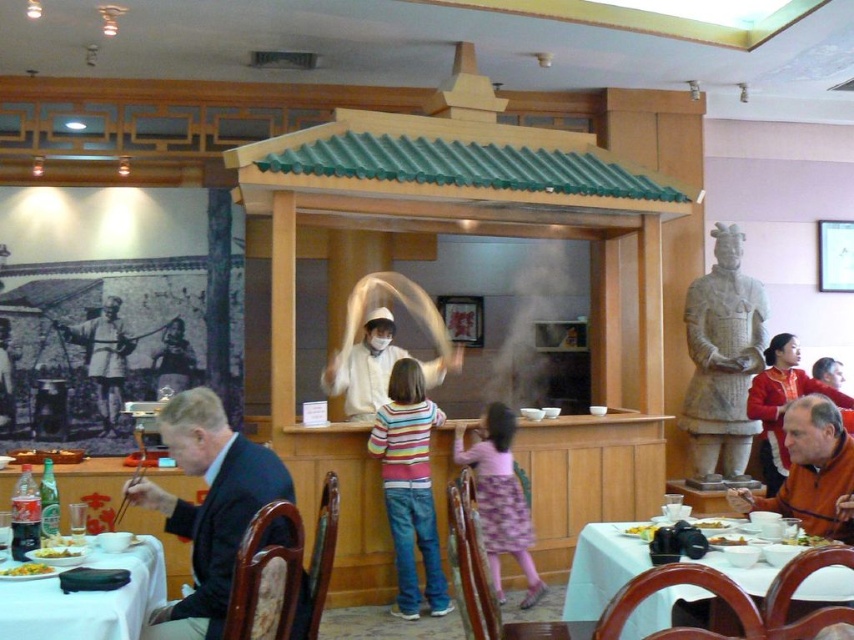
Question: Can you confirm if dark blue suit at left is thinner than white glossy chef hat at center?

Choices:
 (A) no
 (B) yes

Answer: (B)

Question: Is white paper towel at center to the right of yellow matte rice at lower left from the viewer's perspective?

Choices:
 (A) no
 (B) yes

Answer: (A)

Question: Considering the real-world distances, which object is closest to the orange matte jacket at lower right?

Choices:
 (A) smooth gray statue at center
 (B) gray stone statue at right
 (C) striped sweater at center

Answer: (C)

Question: Estimate the real-world distances between objects in this image. Which object is farther from the gray stone statue at right?

Choices:
 (A) white glossy table at lower left
 (B) white glossy table at lower right
 (C) yellow fried chicken at table right
 (D) orange matte jacket at lower right

Answer: (A)

Question: Where is yellow matte rice at lower left located in relation to yellow matte rice at table right in the image?

Choices:
 (A) right
 (B) left

Answer: (B)

Question: Which object appears closest to the camera in this image?

Choices:
 (A) pink floral dress at center
 (B) smooth gray statue at center
 (C) yellow fried chicken at table right
 (D) yellowish matte rice at table right

Answer: (C)